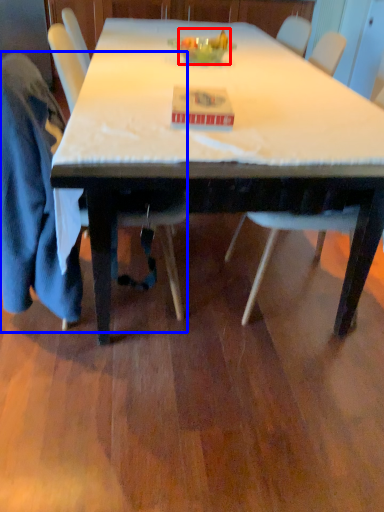
Question: Which object appears closest to the camera in this image, food (highlighted by a red box) or chair (highlighted by a blue box)?

Choices:
 (A) food
 (B) chair

Answer: (B)